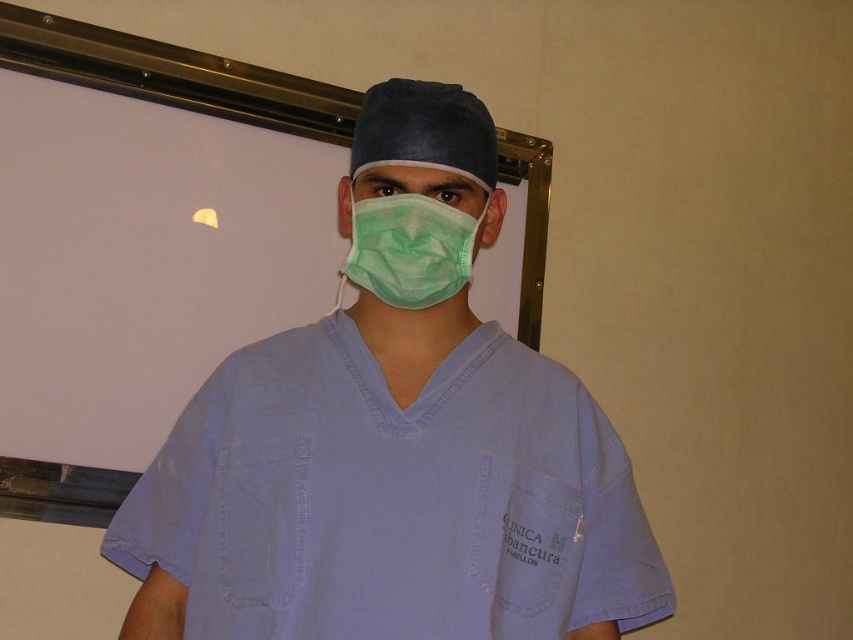
You are a healthcare worker preparing for a procedure. You need to ensure that your light blue scrubs at center and green matte mask at center are properly sized for your body. Based on the image, which item is more likely to be appropriately sized for a standard adult body type?

The light blue scrubs at center has a larger size compared to the green matte mask at center, so the scrubs are more likely to be appropriately sized for a standard adult body type since they are larger and better fit the body.

In the scene shown: You are a medical student observing a healthcare professional in the scene. You notice the light blue scrubs at center and the green matte mask at center. Which item is positioned closer to your viewpoint?

The light blue scrubs at center are closer to the viewer than the green matte mask at center according to the description.